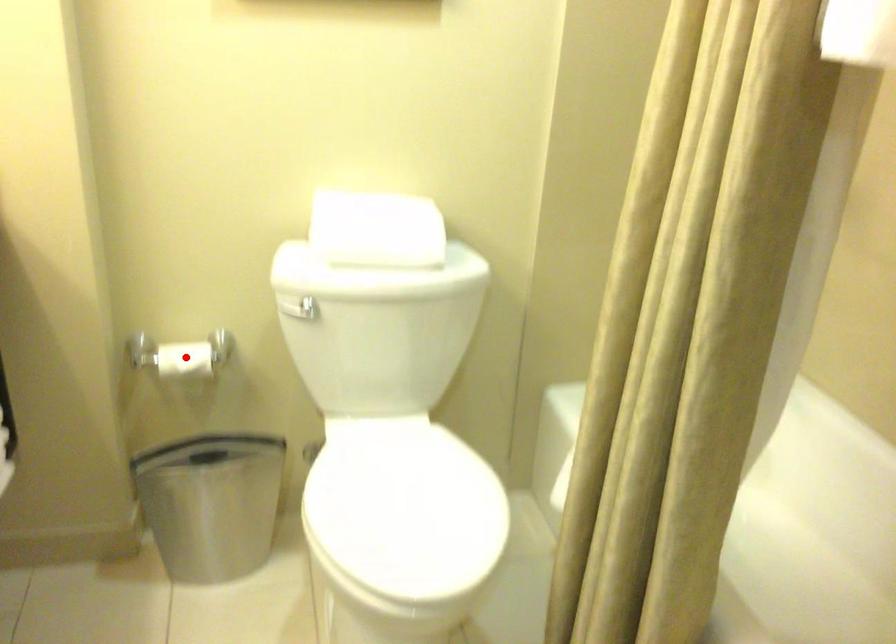
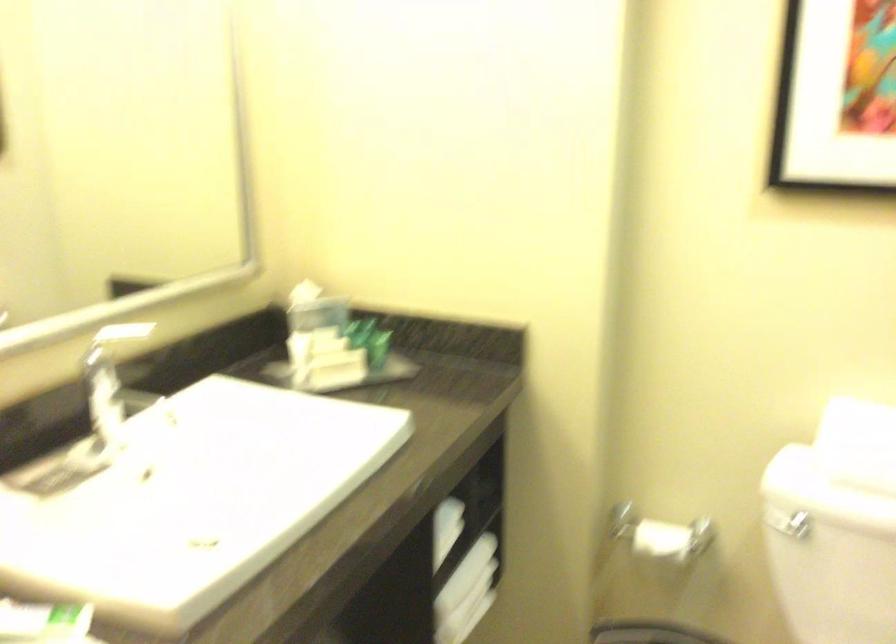
Find the pixel in the second image that matches the highlighted location in the first image.

(660, 540)